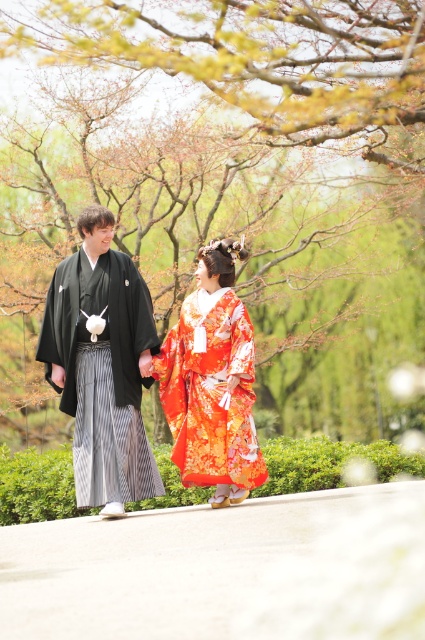
Question: Which point appears closest to the camera in this image?

Choices:
 (A) (85, 593)
 (B) (237, 328)
 (C) (107, 385)

Answer: (A)

Question: Does orange floral kimono at center appear on the right side of floral silk kimono at center?

Choices:
 (A) yes
 (B) no

Answer: (B)

Question: Based on their relative distances, which object is nearer to the orange floral kimono at center?

Choices:
 (A) black silk kimono at left
 (B) smooth concrete path at center
 (C) floral silk kimono at center

Answer: (A)

Question: In this image, where is black silk kimono at left located relative to floral silk kimono at center?

Choices:
 (A) right
 (B) left

Answer: (B)

Question: Can you confirm if orange floral kimono at center is positioned above black silk kimono at left?

Choices:
 (A) no
 (B) yes

Answer: (B)

Question: Estimate the real-world distances between objects in this image. Which object is closer to the smooth concrete path at center?

Choices:
 (A) orange floral kimono at center
 (B) floral silk kimono at center
 (C) black silk kimono at left

Answer: (B)